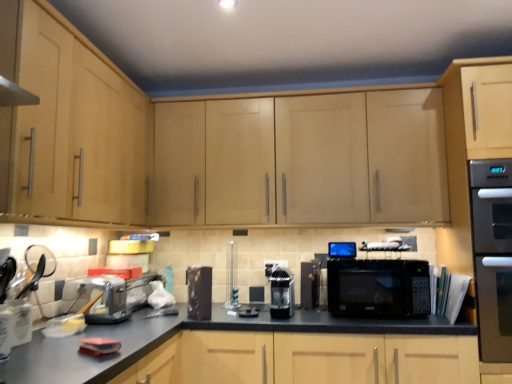
Identify the location of free space in front of sleek black coffee machine at center, marked as the 3th appliance in a right-to-left arrangement. This screenshot has height=384, width=512. (283, 321).